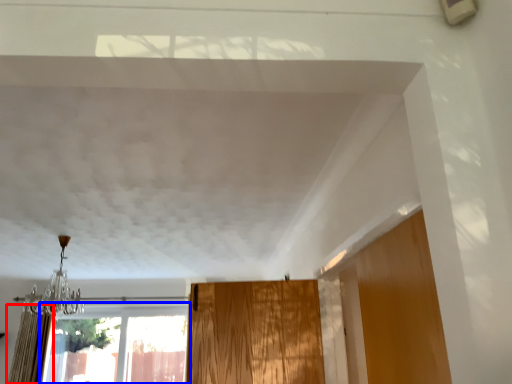
Question: Which object is closer to the camera taking this photo, curtain (highlighted by a red box) or window (highlighted by a blue box)?

Choices:
 (A) curtain
 (B) window

Answer: (A)